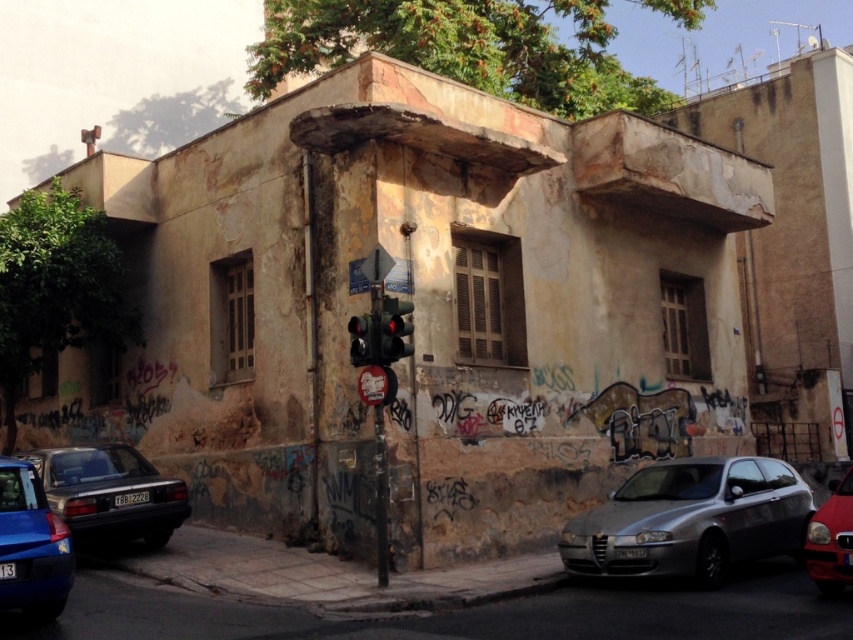
Can you confirm if matte red car at lower right is smaller than metallic traffic light at center?

Correct, matte red car at lower right occupies less space than metallic traffic light at center.

Which is below, matte red car at lower right or metallic traffic light at center?

matte red car at lower right is lower down.

Describe the element at coordinates (831, 540) in the screenshot. The height and width of the screenshot is (640, 853). I see `matte red car at lower right` at that location.

You are a GUI agent. You are given a task and a screenshot of the screen. Output one action in this format:
    pyautogui.click(x=<x>, y=<y>)
    Task: Click on the matte red car at lower right
    Image resolution: width=853 pixels, height=640 pixels.
    Given the screenshot: What is the action you would take?
    pyautogui.click(x=831, y=540)

Does silver metallic car at center lie behind black plastic traffic light at center?

No.

What do you see at coordinates (691, 518) in the screenshot? The image size is (853, 640). I see `silver metallic car at center` at bounding box center [691, 518].

Image resolution: width=853 pixels, height=640 pixels. What are the coordinates of `silver metallic car at center` in the screenshot? It's located at (691, 518).

Is point (38, 593) behind point (402, 336)?

No.

Between point (16, 529) and point (390, 307), which one is positioned behind?

Point (390, 307)

Locate an element on the screen. The image size is (853, 640). metallic blue sedan at lower left is located at coordinates [x=32, y=545].